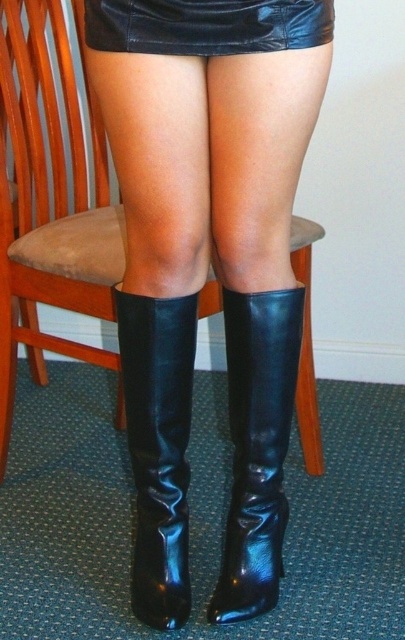
You are a photographer setting up a shoot. You need to adjust the lighting so that the shiny black boot at center reflects the wooden chair at center. Based on their positions, is this possible?

The shiny black boot at center is behind the wooden chair at center, so adjusting the lighting to make the boot reflect the chair might not be possible since the boot is positioned behind the chair and may not have a clear line of sight to it.

You are arranging furniture in a room and need to place the wooden chair at center and the shiny black boot at center so that they align with the room layout. According to the image, which object should be placed to the right side?

The shiny black boot at center should be placed to the right side because the wooden chair at center is to the left of it.

You are a furniture designer assessing the proportions of items in the scene. Which object takes up more space visually between the wooden chair at center and the shiny black boot at center?

The wooden chair at center is bigger than the shiny black boot at center, so it takes up more visual space.